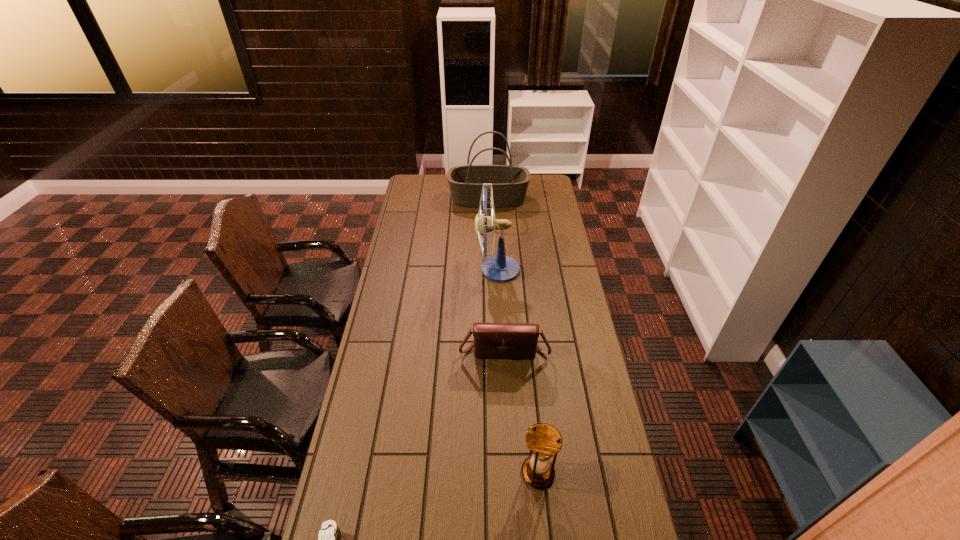
Identify the location of vacant area that lies between the tallest object and the third tallest object. This screenshot has height=540, width=960. (517, 371).

Locate an element on the screen. free space between the third nearest object and the second farthest object is located at coordinates (501, 310).

Select which object appears as the third closest to the third nearest object. Please provide its 2D coordinates. Your answer should be formatted as a tuple, i.e. [(x, y)], where the tuple contains the x and y coordinates of a point satisfying the conditions above.

[(329, 537)]

Where is `object that is the fourth nearest to the shoulder bag`? The height and width of the screenshot is (540, 960). object that is the fourth nearest to the shoulder bag is located at coordinates (509, 183).

Where is `free space that satisfies the following two spatial constraints: 1. on the front side of the hourglass; 2. on the right side of the basket`? free space that satisfies the following two spatial constraints: 1. on the front side of the hourglass; 2. on the right side of the basket is located at coordinates (495, 472).